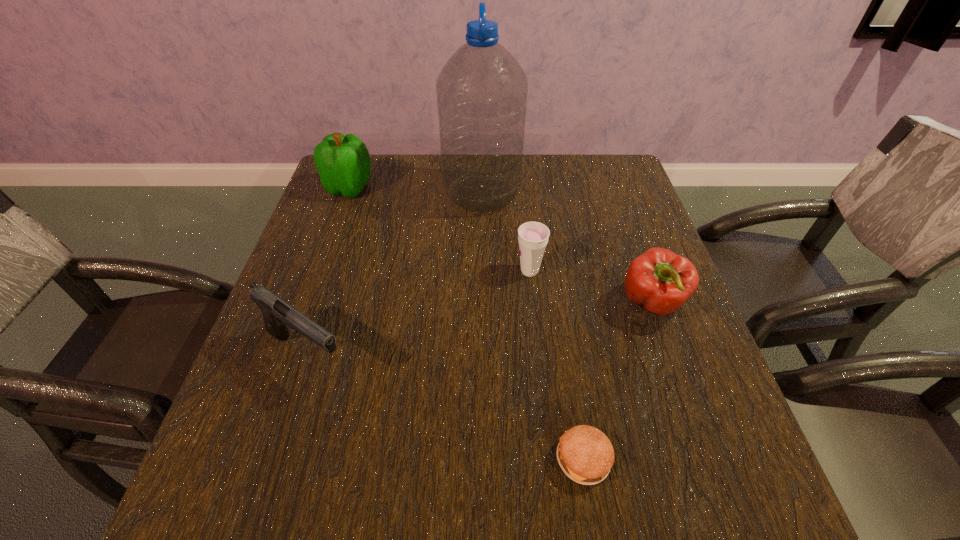
At what (x,y) coordinates should I click in order to perform the action: click on the tallest object. Please return your answer as a coordinate pair (x, y). Image resolution: width=960 pixels, height=540 pixels. Looking at the image, I should click on (482, 91).

Find the location of a particular element. the taller bell pepper is located at coordinates (343, 162).

Locate an element on the screen. This screenshot has height=540, width=960. the left bell pepper is located at coordinates (343, 162).

At what (x,y) coordinates should I click in order to perform the action: click on gun. Please return your answer as a coordinate pair (x, y). This screenshot has width=960, height=540. Looking at the image, I should click on (278, 316).

Find the location of a particular element. the right bell pepper is located at coordinates (660, 281).

Find the location of a particular element. Image resolution: width=960 pixels, height=540 pixels. the nearer bell pepper is located at coordinates (660, 281).

Locate an element on the screen. This screenshot has width=960, height=540. cup is located at coordinates (x=533, y=237).

Identify the location of hamburger. (585, 454).

This screenshot has width=960, height=540. Identify the location of the nearest object. (585, 454).

Locate an element on the screen. vacant space situated 0.230m on the right of the tallest object is located at coordinates [603, 194].